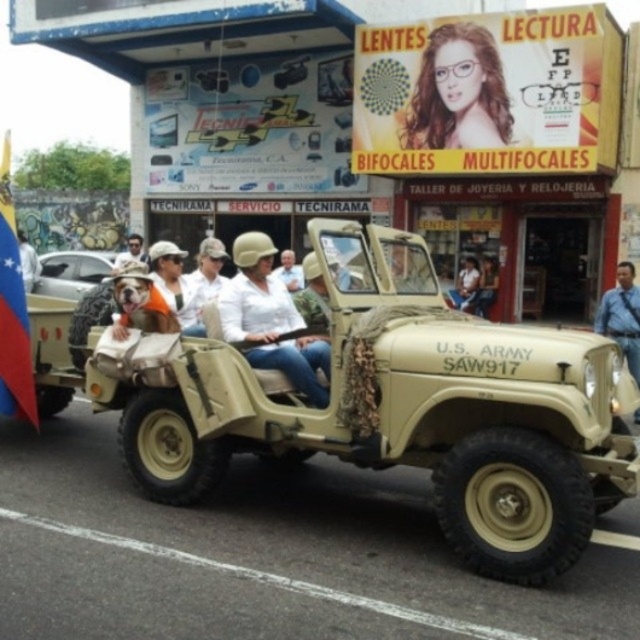
Between point (493, 67) and point (186, 300), which one is positioned in front?

Positioned in front is point (186, 300).

Between smooth skin face at upper center and white matte shirt at center, which one is positioned higher?

smooth skin face at upper center is higher up.

Is point (428, 120) closer to camera compared to point (179, 284)?

No, (428, 120) is behind (179, 284).

Where is `smooth skin face at upper center`? smooth skin face at upper center is located at coordinates (458, 92).

Between point (464, 56) and point (19, 234), which one is positioned in front?

Positioned in front is point (464, 56).

Does point (456, 65) come farther from viewer compared to point (29, 291)?

Yes.

Locate an element on the screen. smooth skin face at upper center is located at coordinates (458, 92).

Is smooth skin face at upper center below silver metallic car at left?

No, smooth skin face at upper center is not below silver metallic car at left.

Can you confirm if smooth skin face at upper center is thinner than silver metallic car at left?

No.

Identify the location of smooth skin face at upper center. (458, 92).